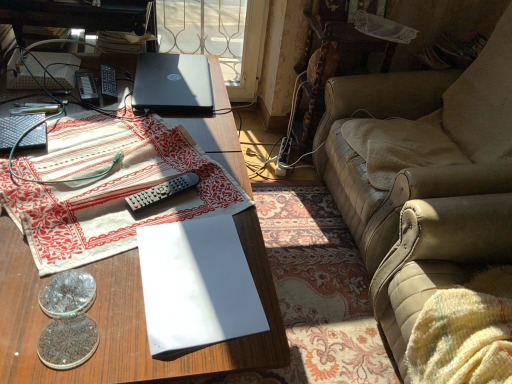
Image resolution: width=512 pixels, height=384 pixels. What are the coordinates of `free space to the back side of shiny metallic coin at lower left, placed as the 1th coin when sorted from back to front` in the screenshot? It's located at (91, 230).